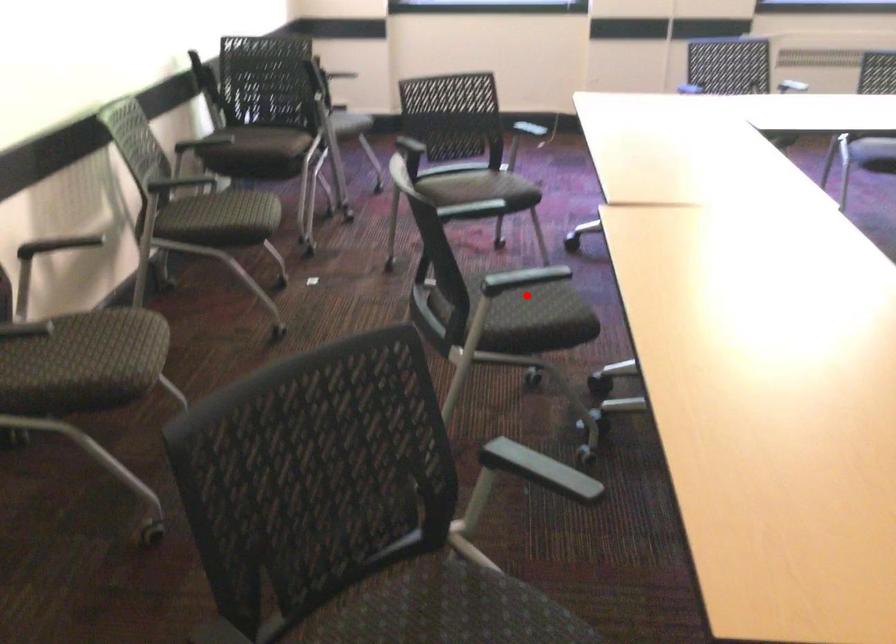
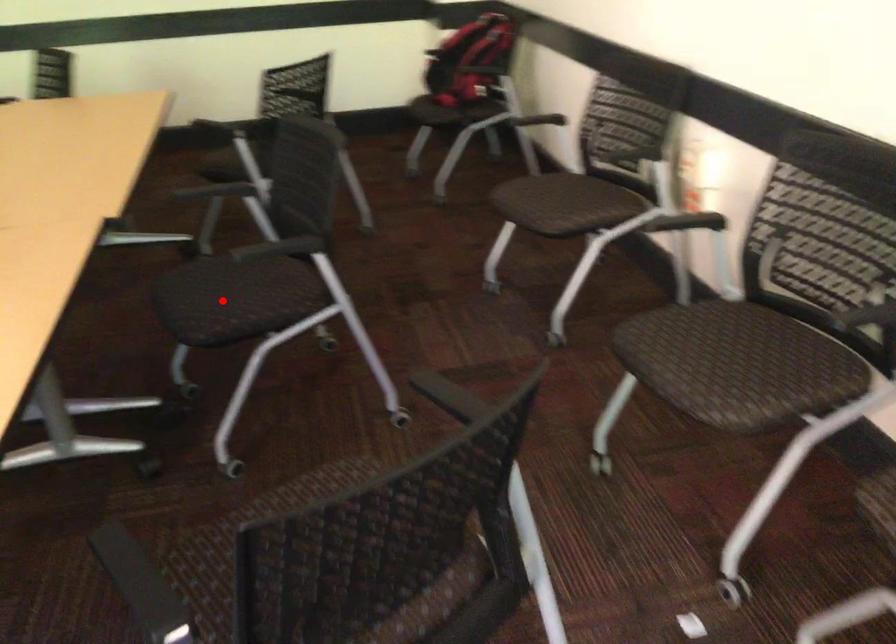
I am providing you with two images of the same scene from different viewpoints. A red point is marked on the first image and another point is marked on the second image. Are the points marked in image1 and image2 representing the same 3D position?

Yes